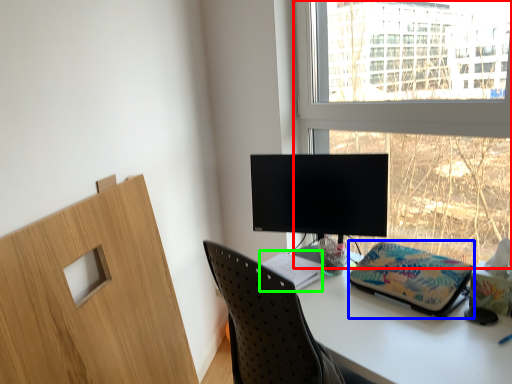
Question: Estimate the real-world distances between objects in this image. Which object is closer to window (highlighted by a red box), stationery (highlighted by a blue box) or notebook (highlighted by a green box)?

Choices:
 (A) stationery
 (B) notebook

Answer: (A)